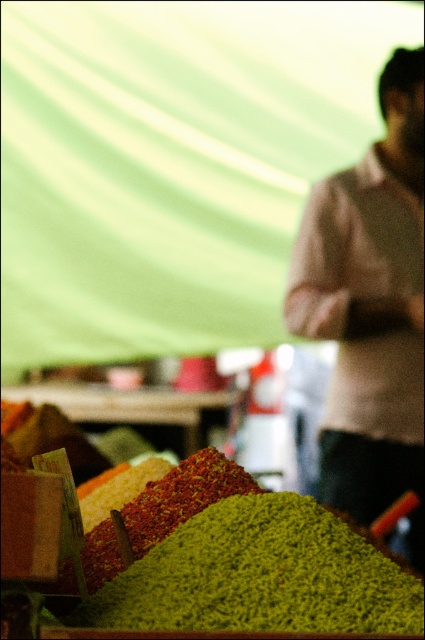
You are a customer at the market and want to buy the green granular spice at center and the green granular spices at center. Which one of these two has a larger quantity available?

The green granular spices at center has a larger quantity available because it is bigger in size compared to the green granular spice at center.

You are a vendor at the market and need to place both the light brown sweater at right and the green granular spice at center on a shelf. If the shelf has limited space, which item should you place first to maximize shelf usage?

The light brown sweater at right has a larger width than the green granular spice at center, so you should place the light brown sweater at right first to accommodate its size and then fit the smaller green granular spice at center next.

You are a customer at the market and want to pick up the light brown sweater at right and the green granular spices at center. Which item is taller?

The light brown sweater at right is much taller than the green granular spices at center.